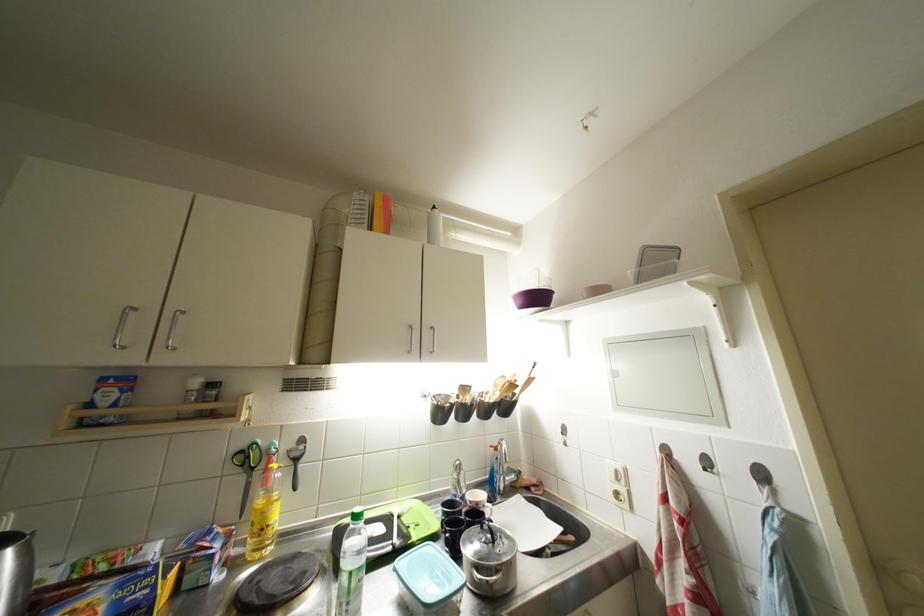
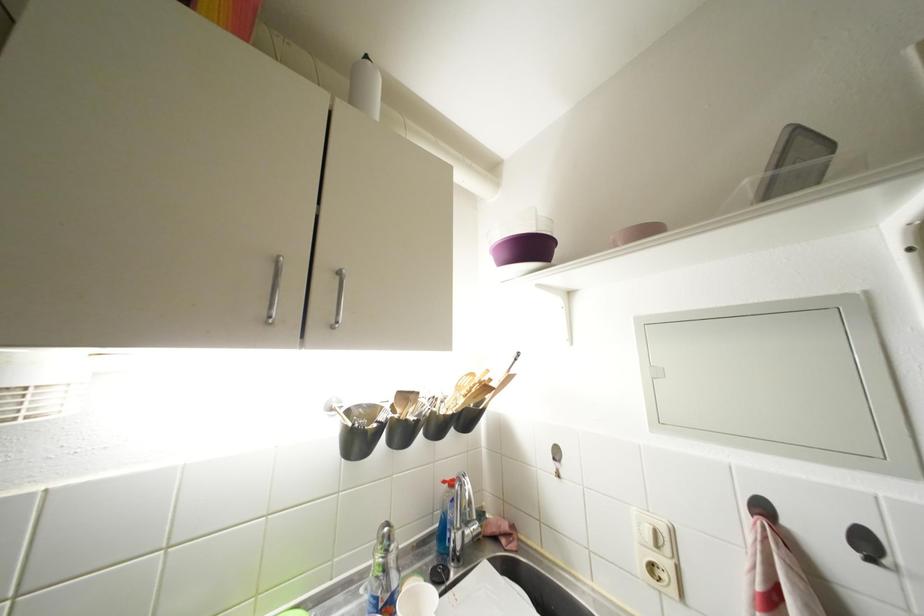
In the second image, find the point that corresponds to [503,453] in the first image.

(457, 488)